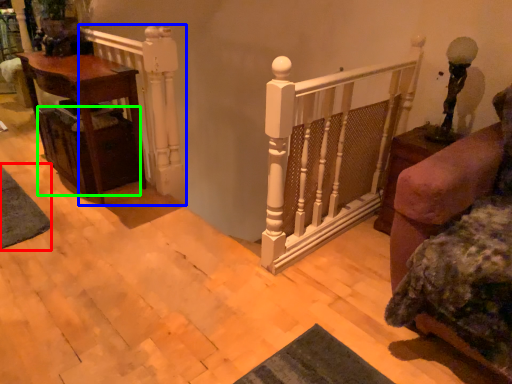
Question: Considering the real-world distances, which object is farthest from mat (highlighted by a red box)? rail (highlighted by a blue box) or drawer (highlighted by a green box)?

Choices:
 (A) rail
 (B) drawer

Answer: (A)